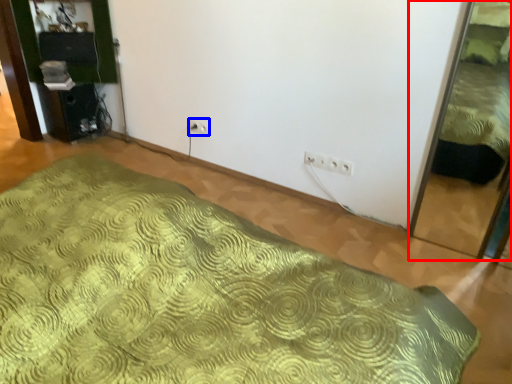
Question: Which point is closer to the camera, bed (highlighted by a red box) or electric outlet (highlighted by a blue box)?

Choices:
 (A) bed
 (B) electric outlet

Answer: (A)